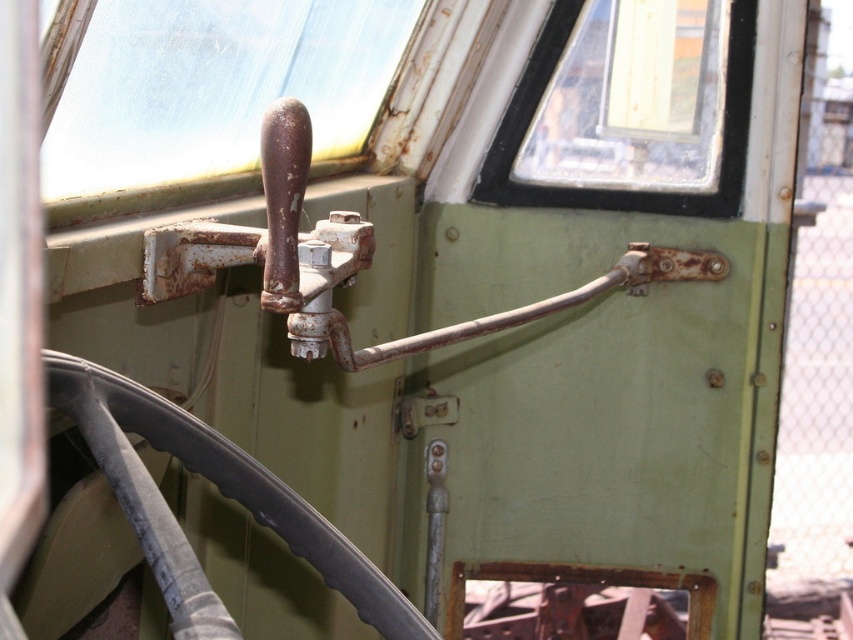
Question: Does transparent plastic handle at upper center have a greater width compared to rusty metal handle at center?

Choices:
 (A) yes
 (B) no

Answer: (B)

Question: Is transparent plastic handle at upper center further to the viewer compared to transparent glass window at upper center?

Choices:
 (A) yes
 (B) no

Answer: (B)

Question: Considering the real-world distances, which object is farthest from the rusty metal handle at center?

Choices:
 (A) transparent plastic handle at upper center
 (B) transparent glass window at upper center

Answer: (B)

Question: Which point appears closest to the camera in this image?

Choices:
 (A) (115, 115)
 (B) (527, 108)

Answer: (A)

Question: Is rusty metal handle at center to the right of transparent glass window at upper center from the viewer's perspective?

Choices:
 (A) no
 (B) yes

Answer: (A)

Question: Which object is the closest to the transparent plastic handle at upper center?

Choices:
 (A) rusty metal handle at center
 (B) transparent glass window at upper center

Answer: (A)